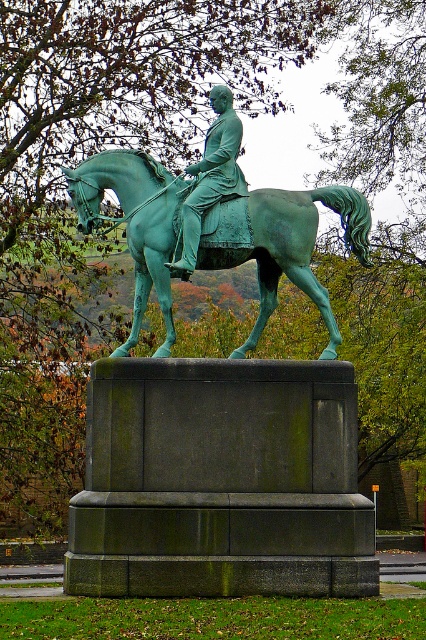
Who is shorter, green patina horse at center or green patina statue at center?

green patina statue at center

Which is below, green patina horse at center or green patina statue at center?

green patina horse at center is below.

This screenshot has height=640, width=426. Find the location of `green patina horse at center`. green patina horse at center is located at coordinates [x=287, y=246].

Who is more forward, (x=144, y=253) or (x=157, y=353)?

Point (x=157, y=353) is more forward.

Which of these two, green patinated bronze statue at center or green patina horse at center, stands shorter?

green patina horse at center

You are a GUI agent. You are given a task and a screenshot of the screen. Output one action in this format:
    pyautogui.click(x=<x>, y=<y>)
    Task: Click on the green patinated bronze statue at center
    This screenshot has width=426, height=640.
    Given the screenshot: What is the action you would take?
    pyautogui.click(x=218, y=406)

The width and height of the screenshot is (426, 640). Find the location of `green patinated bronze statue at center`. green patinated bronze statue at center is located at coordinates (218, 406).

You are a GUI agent. You are given a task and a screenshot of the screen. Output one action in this format:
    pyautogui.click(x=<x>, y=<y>)
    Task: Click on the green patinated bronze statue at center
    Image resolution: width=426 pixels, height=640 pixels.
    Given the screenshot: What is the action you would take?
    pyautogui.click(x=218, y=406)

Describe the element at coordinates (218, 406) in the screenshot. I see `green patinated bronze statue at center` at that location.

What are the coordinates of `green patinated bronze statue at center` in the screenshot? It's located at (218, 406).